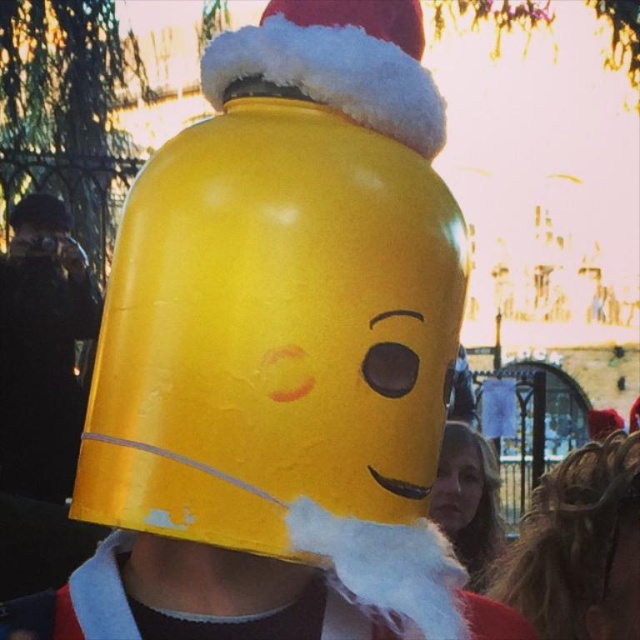
Question: Is matte yellow helmet at center further to camera compared to smooth skin face at lower right?

Choices:
 (A) no
 (B) yes

Answer: (A)

Question: Which of the following is the farthest from the observer?

Choices:
 (A) (275, 131)
 (B) (438, 483)

Answer: (B)

Question: Among these points, which one is farthest from the camera?

Choices:
 (A) (442, 504)
 (B) (234, 432)

Answer: (A)

Question: Among these points, which one is nearest to the camera?

Choices:
 (A) (435, 227)
 (B) (436, 502)

Answer: (A)

Question: Does matte yellow helmet at center have a lesser width compared to smooth skin face at lower right?

Choices:
 (A) no
 (B) yes

Answer: (A)

Question: Can you confirm if matte yellow helmet at center is bigger than smooth skin face at lower right?

Choices:
 (A) yes
 (B) no

Answer: (A)